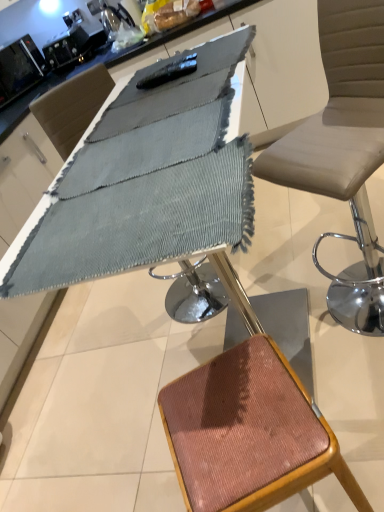
Question: Does black glossy microwave at upper left turn towards textured gray fabric at center?

Choices:
 (A) yes
 (B) no

Answer: (A)

Question: Is black glossy microwave at upper left looking in the opposite direction of textured gray fabric at center?

Choices:
 (A) yes
 (B) no

Answer: (B)

Question: Considering the relative sizes of black glossy microwave at upper left and textured gray fabric at center in the image provided, is black glossy microwave at upper left smaller than textured gray fabric at center?

Choices:
 (A) no
 (B) yes

Answer: (A)

Question: Is black glossy microwave at upper left next to textured gray fabric at center?

Choices:
 (A) no
 (B) yes

Answer: (A)

Question: Considering the relative sizes of black glossy microwave at upper left and textured gray fabric at center in the image provided, is black glossy microwave at upper left wider than textured gray fabric at center?

Choices:
 (A) no
 (B) yes

Answer: (A)

Question: From the image's perspective, is textured gray fabric at center located above or below black glossy microwave at upper left?

Choices:
 (A) above
 (B) below

Answer: (B)

Question: Is textured gray fabric at center taller or shorter than black glossy microwave at upper left?

Choices:
 (A) short
 (B) tall

Answer: (A)

Question: Based on their positions, is textured gray fabric at center located to the left or right of black glossy microwave at upper left?

Choices:
 (A) left
 (B) right

Answer: (B)

Question: Relative to black glossy microwave at upper left, is textured gray fabric at center in front or behind?

Choices:
 (A) front
 (B) behind

Answer: (A)

Question: From a real-world perspective, relative to rustic wood stool at lower right, is black glossy microwave at upper left vertically above or below?

Choices:
 (A) above
 (B) below

Answer: (A)

Question: Looking at their shapes, would you say black glossy microwave at upper left is wider or thinner than rustic wood stool at lower right?

Choices:
 (A) wide
 (B) thin

Answer: (B)

Question: Based on their sizes in the image, would you say black glossy microwave at upper left is bigger or smaller than rustic wood stool at lower right?

Choices:
 (A) big
 (B) small

Answer: (B)

Question: Is black glossy microwave at upper left taller or shorter than rustic wood stool at lower right?

Choices:
 (A) short
 (B) tall

Answer: (A)

Question: Relative to black glossy microwave at upper left, is rustic wood stool at lower right in front or behind?

Choices:
 (A) behind
 (B) front

Answer: (B)

Question: Is point (296, 415) positioned closer to the camera than point (0, 71)?

Choices:
 (A) farther
 (B) closer

Answer: (B)